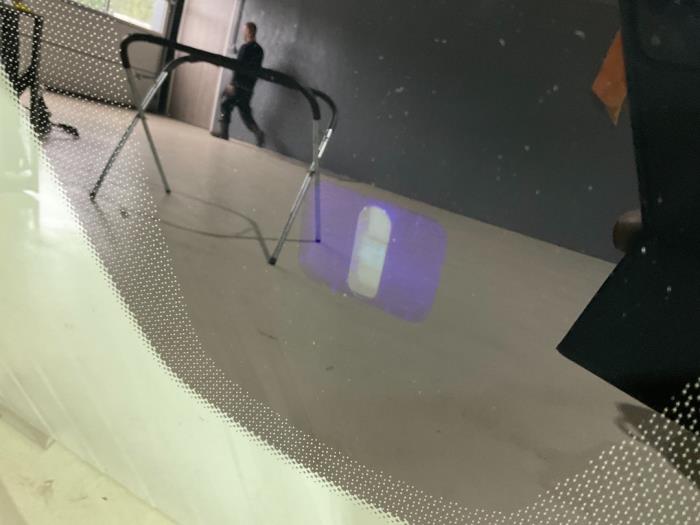
In order to click on window in this screenshot , I will do `click(138, 10)`.